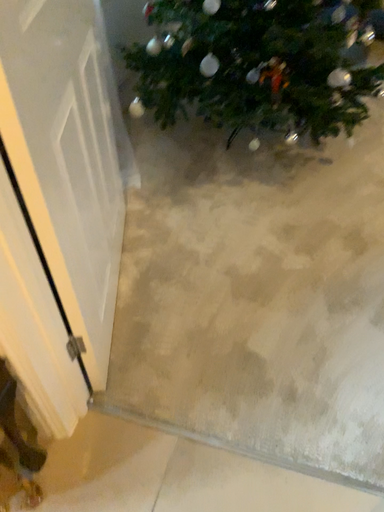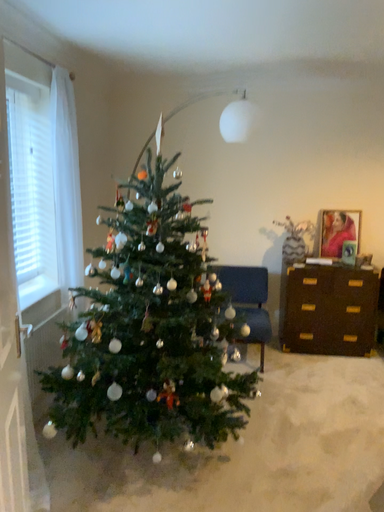
Question: Which way did the camera rotate in the video?

Choices:
 (A) rotated upward
 (B) rotated downward

Answer: (A)